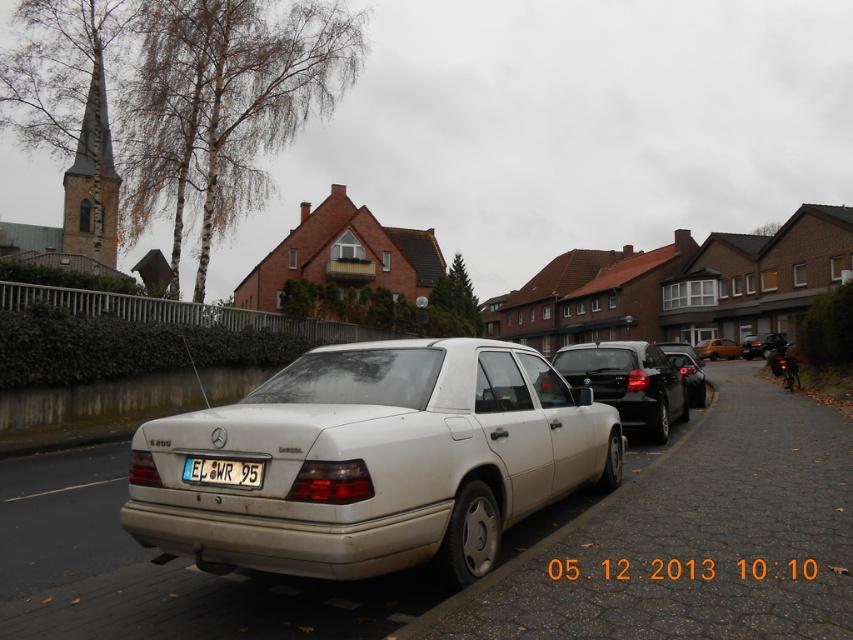
Between white plastic license plate at center and glossy black car at right, which one is positioned lower?

glossy black car at right

Between point (258, 472) and point (685, 384), which one is positioned in front?

Point (258, 472) is in front.

Locate an element on the screen. The height and width of the screenshot is (640, 853). white plastic license plate at center is located at coordinates (223, 472).

Based on the photo, does white plastic license plate at center have a lesser height compared to matte black sedan at center?

Yes.

Which is above, white plastic license plate at center or matte black sedan at center?

white plastic license plate at center is higher up.

Locate an element on the screen. white plastic license plate at center is located at coordinates (223, 472).

Can you confirm if silver metallic sedan at center is wider than glossy black car at right?

In fact, silver metallic sedan at center might be narrower than glossy black car at right.

Which is above, silver metallic sedan at center or glossy black car at right?

silver metallic sedan at center

Image resolution: width=853 pixels, height=640 pixels. Describe the element at coordinates (374, 460) in the screenshot. I see `silver metallic sedan at center` at that location.

Where is `silver metallic sedan at center`? silver metallic sedan at center is located at coordinates (374, 460).